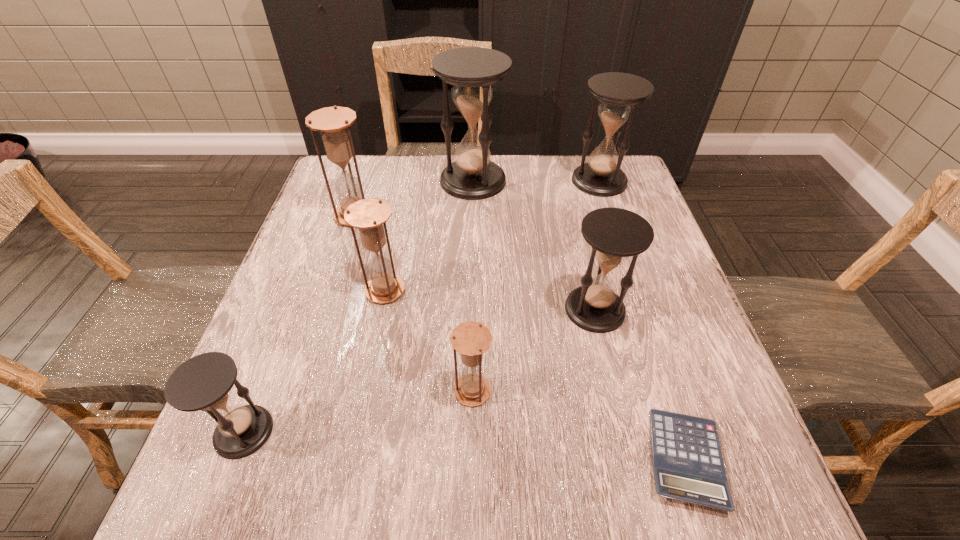
The image size is (960, 540). Identify the location of free point between the rightmost brown hourglass and the second biggest black hourglass. (536, 286).

You are a GUI agent. You are given a task and a screenshot of the screen. Output one action in this format:
    pyautogui.click(x=<x>, y=<y>)
    Task: Click on the free space that is in between the biggest brown hourglass and the smallest brown hourglass
    
    Given the screenshot: What is the action you would take?
    pyautogui.click(x=414, y=303)

Find the location of a particular element. This screenshot has width=960, height=540. object that is the second nearest to the second smallest black hourglass is located at coordinates (471, 339).

Select which object is the fourth closest to the tallest object. Please provide its 2D coordinates. Your answer should be formatted as a tuple, i.e. [(x, y)], where the tuple contains the x and y coordinates of a point satisfying the conditions above.

[(615, 234)]

Choose which hourglass is the third nearest neighbor to the second smallest black hourglass. Please provide its 2D coordinates. Your answer should be formatted as a tuple, i.e. [(x, y)], where the tuple contains the x and y coordinates of a point satisfying the conditions above.

[(471, 70)]

Locate an element on the screen. The height and width of the screenshot is (540, 960). hourglass that is the closest one to the smallest black hourglass is located at coordinates (369, 215).

Choose which black hourglass is the nearest neighbor to the leftmost black hourglass. Please provide its 2D coordinates. Your answer should be formatted as a tuple, i.e. [(x, y)], where the tuple contains the x and y coordinates of a point satisfying the conditions above.

[(615, 234)]

What are the coordinates of `black hourglass that is the third closest to the smallest brown hourglass` in the screenshot? It's located at (471, 70).

Identify which brown hourglass is the closest to the leftmost brown hourglass. Please provide its 2D coordinates. Your answer should be formatted as a tuple, i.e. [(x, y)], where the tuple contains the x and y coordinates of a point satisfying the conditions above.

[(369, 215)]

The width and height of the screenshot is (960, 540). In order to click on brown hourglass that can be found as the second closest to the nearest brown hourglass in this screenshot , I will do `click(333, 123)`.